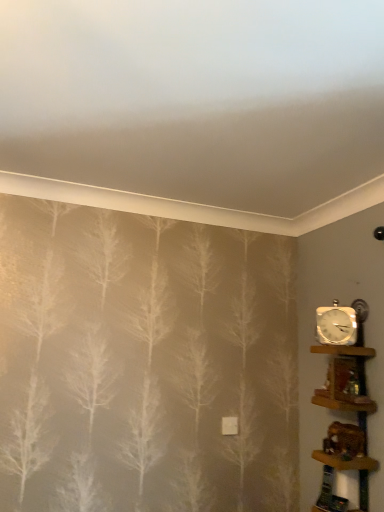
Locate an element on the screen. The width and height of the screenshot is (384, 512). wooden shelf at right, acting as the 1th shelf starting from the bottom is located at coordinates (348, 410).

Image resolution: width=384 pixels, height=512 pixels. What do you see at coordinates (348, 410) in the screenshot?
I see `wooden shelf at right, acting as the 1th shelf starting from the bottom` at bounding box center [348, 410].

Image resolution: width=384 pixels, height=512 pixels. What do you see at coordinates (342, 399) in the screenshot? I see `wooden shelf at right, the 1th shelf in the top-to-bottom sequence` at bounding box center [342, 399].

Identify the location of white metallic clock at right. (336, 325).

This screenshot has width=384, height=512. In order to click on shelf on the right side of white metallic clock at right in this screenshot , I will do `click(342, 399)`.

From the image's perspective, which object appears higher, white metallic clock at right or wooden shelf at right, the 1th shelf in the top-to-bottom sequence?

white metallic clock at right is shown above in the image.

Would you say white metallic clock at right is to the left or to the right of wooden shelf at right, the 2th shelf when ordered from bottom to top, in the picture?

Based on their positions, white metallic clock at right is located to the left of wooden shelf at right, the 2th shelf when ordered from bottom to top.

Considering the positions of points (336, 397) and (352, 402), is point (336, 397) closer to camera compared to point (352, 402)?

No, (336, 397) is behind (352, 402).

Is the depth of wooden shelf at right, marked as the second shelf in a top-to-bottom arrangement, less than that of wooden shelf at right, the 1th shelf in the top-to-bottom sequence?

Yes, wooden shelf at right, marked as the second shelf in a top-to-bottom arrangement, is closer to the viewer.

At what (x,y) coordinates should I click in order to perform the action: click on shelf in front of the wooden shelf at right, the 2th shelf when ordered from bottom to top. Please return your answer as a coordinate pair (x, y). Looking at the image, I should click on (348, 410).

From their relative heights in the image, would you say wooden shelf at right, marked as the second shelf in a top-to-bottom arrangement, is taller or shorter than wooden shelf at right, the 1th shelf in the top-to-bottom sequence?

Considering their sizes, wooden shelf at right, marked as the second shelf in a top-to-bottom arrangement, has more height than wooden shelf at right, the 1th shelf in the top-to-bottom sequence.

Would you consider wooden shelf at right, the 2th shelf when ordered from bottom to top, to be distant from white metallic clock at right?

No, wooden shelf at right, the 2th shelf when ordered from bottom to top, is not far away from white metallic clock at right.

From a real-world perspective, is wooden shelf at right, the 2th shelf when ordered from bottom to top, positioned above or below white metallic clock at right?

From a real-world perspective, wooden shelf at right, the 2th shelf when ordered from bottom to top, is physically below white metallic clock at right.

Is wooden shelf at right, the 1th shelf in the top-to-bottom sequence, oriented away from white metallic clock at right?

No.

Is wooden shelf at right, acting as the 1th shelf starting from the bottom, looking in the opposite direction of white metallic clock at right?

No, wooden shelf at right, acting as the 1th shelf starting from the bottom,'s orientation is not away from white metallic clock at right.

In the scene shown: Which point is more distant from viewer, (357,464) or (355,338)?

Point (355,338)

Looking at this image, does wooden shelf at right, marked as the second shelf in a top-to-bottom arrangement, have a larger size compared to white metallic clock at right?

Yes, wooden shelf at right, marked as the second shelf in a top-to-bottom arrangement, is bigger than white metallic clock at right.

From a real-world perspective, is wooden shelf at right, marked as the second shelf in a top-to-bottom arrangement, below white metallic clock at right?

Correct, in the physical world, wooden shelf at right, marked as the second shelf in a top-to-bottom arrangement, is lower than white metallic clock at right.

Considering the relative positions of white metallic clock at right and wooden shelf at right, marked as the second shelf in a top-to-bottom arrangement, in the image provided, is white metallic clock at right to the left or to the right of wooden shelf at right, marked as the second shelf in a top-to-bottom arrangement,?

In the image, white metallic clock at right appears on the right side of wooden shelf at right, marked as the second shelf in a top-to-bottom arrangement.

Considering the sizes of white metallic clock at right and wooden shelf at right, marked as the second shelf in a top-to-bottom arrangement, in the image, is white metallic clock at right bigger or smaller than wooden shelf at right, marked as the second shelf in a top-to-bottom arrangement,?

Clearly, white metallic clock at right is smaller in size than wooden shelf at right, marked as the second shelf in a top-to-bottom arrangement.

Looking at their sizes, would you say white metallic clock at right is wider or thinner than wooden shelf at right, marked as the second shelf in a top-to-bottom arrangement?

In the image, white metallic clock at right appears to be more narrow than wooden shelf at right, marked as the second shelf in a top-to-bottom arrangement.

Based on the photo, from the image's perspective, which one is positioned lower, white metallic clock at right or wooden shelf at right, marked as the second shelf in a top-to-bottom arrangement?

From the image's view, wooden shelf at right, marked as the second shelf in a top-to-bottom arrangement, is below.

At what (x,y) coordinates should I click in order to perform the action: click on shelf lying behind the wooden shelf at right, marked as the second shelf in a top-to-bottom arrangement. Please return your answer as a coordinate pair (x, y). The image size is (384, 512). Looking at the image, I should click on (342, 399).

Considering the positions of objects wooden shelf at right, the 2th shelf when ordered from bottom to top, and wooden shelf at right, marked as the second shelf in a top-to-bottom arrangement, in the image provided, who is more to the left, wooden shelf at right, the 2th shelf when ordered from bottom to top, or wooden shelf at right, marked as the second shelf in a top-to-bottom arrangement,?

wooden shelf at right, marked as the second shelf in a top-to-bottom arrangement.

Is wooden shelf at right, the 1th shelf in the top-to-bottom sequence, in front of wooden shelf at right, acting as the 1th shelf starting from the bottom?

That is False.

From a real-world perspective, which object stands above the other?

wooden shelf at right, the 2th shelf when ordered from bottom to top.

This screenshot has width=384, height=512. Find the location of `clock that is behind the wooden shelf at right, the 2th shelf when ordered from bottom to top`. clock that is behind the wooden shelf at right, the 2th shelf when ordered from bottom to top is located at coordinates (336, 325).

In the image, there is a wooden shelf at right, the 2th shelf when ordered from bottom to top. Where is `shelf below it (from a real-world perspective)`? shelf below it (from a real-world perspective) is located at coordinates (348, 410).

Based on their spatial positions, is wooden shelf at right, the 1th shelf in the top-to-bottom sequence, or white metallic clock at right closer to wooden shelf at right, acting as the 1th shelf starting from the bottom?

wooden shelf at right, the 1th shelf in the top-to-bottom sequence, is positioned closer to the anchor wooden shelf at right, acting as the 1th shelf starting from the bottom.

From the image, which object appears to be nearer to wooden shelf at right, the 2th shelf when ordered from bottom to top, white metallic clock at right or wooden shelf at right, acting as the 1th shelf starting from the bottom?

Among the two, wooden shelf at right, acting as the 1th shelf starting from the bottom, is located nearer to wooden shelf at right, the 2th shelf when ordered from bottom to top.

Consider the image. From the image, which object appears to be farther from wooden shelf at right, acting as the 1th shelf starting from the bottom, white metallic clock at right or wooden shelf at right, the 2th shelf when ordered from bottom to top?

Based on the image, white metallic clock at right appears to be further to wooden shelf at right, acting as the 1th shelf starting from the bottom.

Considering their positions, is wooden shelf at right, acting as the 1th shelf starting from the bottom, positioned closer to white metallic clock at right than wooden shelf at right, the 1th shelf in the top-to-bottom sequence?

Among the two, wooden shelf at right, the 1th shelf in the top-to-bottom sequence, is located nearer to white metallic clock at right.

From the image, which object appears to be farther from wooden shelf at right, the 1th shelf in the top-to-bottom sequence, wooden shelf at right, acting as the 1th shelf starting from the bottom, or white metallic clock at right?

Among the two, white metallic clock at right is located further to wooden shelf at right, the 1th shelf in the top-to-bottom sequence.

Estimate the real-world distances between objects in this image. Which object is further from white metallic clock at right, wooden shelf at right, the 1th shelf in the top-to-bottom sequence, or wooden shelf at right, marked as the second shelf in a top-to-bottom arrangement?

The object further to white metallic clock at right is wooden shelf at right, marked as the second shelf in a top-to-bottom arrangement.

Locate an element on the screen. This screenshot has height=512, width=384. shelf between white metallic clock at right and wooden shelf at right, marked as the second shelf in a top-to-bottom arrangement, from top to bottom is located at coordinates (342, 399).